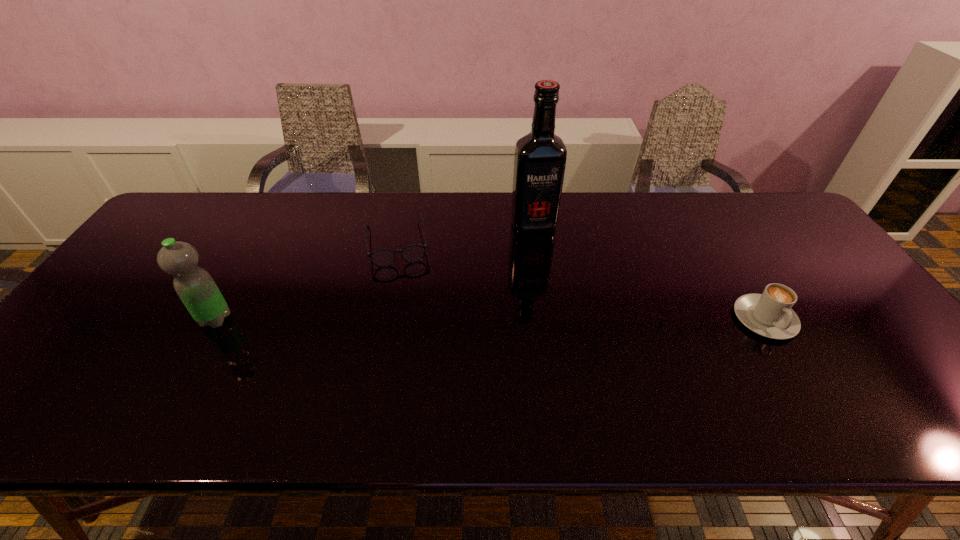
Where is `the leftmost object`? the leftmost object is located at coordinates (196, 288).

The height and width of the screenshot is (540, 960). I want to click on water bottle, so [x=196, y=288].

Locate an element on the screen. This screenshot has height=540, width=960. the second shortest object is located at coordinates (769, 314).

I want to click on cappuccino, so click(x=769, y=314).

At what (x,y) coordinates should I click in order to perform the action: click on the second object from left to right. Please return your answer as a coordinate pair (x, y). The image size is (960, 540). Looking at the image, I should click on (413, 253).

The image size is (960, 540). I want to click on spectacles, so (x=413, y=253).

Find the location of a particular element. The image size is (960, 540). the tallest object is located at coordinates (540, 157).

This screenshot has height=540, width=960. Identify the location of liquor. (540, 157).

The height and width of the screenshot is (540, 960). I want to click on vacant region located 0.130m on the left of the leftmost object, so 148,319.

Image resolution: width=960 pixels, height=540 pixels. In order to click on vacant space located to the right of the third tallest object in this screenshot , I will do `click(794, 367)`.